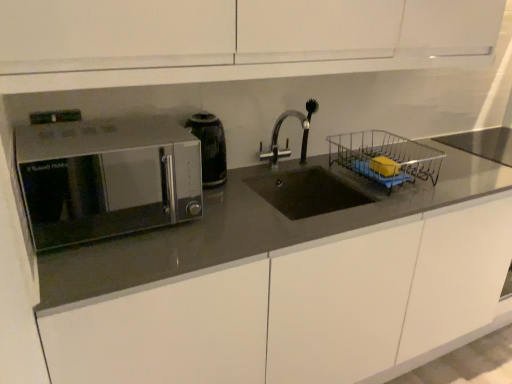
This screenshot has width=512, height=384. I want to click on metallic wire basket at center right, so click(x=385, y=157).

In order to face satin silver microwave at left, should I rotate leftwards or rightwards?

A 18.221 degree turn to the left will do.

Locate an element on the screen. black glossy electric kettle at center-left is located at coordinates (210, 147).

From a real-world perspective, which object stands above the other?

satin silver microwave at left is physically above.

Which of these two, metallic wire basket at center right or satin silver microwave at left, stands taller?

With more height is satin silver microwave at left.

Between metallic wire basket at center right and satin silver microwave at left, which one has larger width?

satin silver microwave at left is wider.

Considering the positions of objects metallic wire basket at center right and satin silver microwave at left in the image provided, who is in front, metallic wire basket at center right or satin silver microwave at left?

satin silver microwave at left is in front.

Is satin metallic microwave at left with silver metallic faucet at center?

No, satin metallic microwave at left is not touching silver metallic faucet at center.

Locate an element on the screen. The width and height of the screenshot is (512, 384). countertop that appears in front of the silver metallic faucet at center is located at coordinates (247, 230).

Considering the points (320, 221) and (264, 154), which point is behind, point (320, 221) or point (264, 154)?

The point (264, 154) is farther.

From a real-world perspective, is satin metallic microwave at left positioned above or below silver metallic faucet at center?

satin metallic microwave at left is below silver metallic faucet at center.

The width and height of the screenshot is (512, 384). What are the coordinates of `appliance behind the satin silver microwave at left` in the screenshot? It's located at (210, 147).

From the image's perspective, between satin silver microwave at left and black glossy electric kettle at center-left, who is located below?

satin silver microwave at left, from the image's perspective.

In the scene shown: Is black glossy electric kettle at center-left a part of satin silver microwave at left?

No, black glossy electric kettle at center-left is located outside of satin silver microwave at left.

Is satin silver microwave at left aimed at black glossy electric kettle at center-left?

No, satin silver microwave at left does not turn towards black glossy electric kettle at center-left.

Which object is positioned more to the left, silver metallic faucet at center or satin silver microwave at left?

satin silver microwave at left is more to the left.

Which is behind, point (305, 137) or point (31, 159)?

Point (305, 137)

You are a GUI agent. You are given a task and a screenshot of the screen. Output one action in this format:
    pyautogui.click(x=<x>, y=<y>)
    Task: Click on the tap beneath the satin silver microwave at left (from a real-world perspective)
    This screenshot has width=512, height=384.
    Given the screenshot: What is the action you would take?
    pyautogui.click(x=287, y=139)

Is silver metallic faucet at center not close to satin silver microwave at left?

That's right, there is a large distance between silver metallic faucet at center and satin silver microwave at left.

Find the location of a particular element. The height and width of the screenshot is (384, 512). tap lying on the right of satin silver microwave at left is located at coordinates (287, 139).

Are satin silver microwave at left and silver metallic faucet at center located far from each other?

Absolutely, satin silver microwave at left is distant from silver metallic faucet at center.

Consider the image. Which object is wider, satin silver microwave at left or silver metallic faucet at center?

With larger width is satin silver microwave at left.

Is satin silver microwave at left not inside silver metallic faucet at center?

satin silver microwave at left lies outside silver metallic faucet at center's area.

Locate an element on the screen. microwave oven that is above the satin metallic microwave at left (from a real-world perspective) is located at coordinates (106, 178).

Is satin metallic microwave at left spatially inside satin silver microwave at left, or outside of it?

satin metallic microwave at left cannot be found inside satin silver microwave at left.

Does satin metallic microwave at left appear on the left side of satin silver microwave at left?

Result: In fact, satin metallic microwave at left is to the right of satin silver microwave at left.

Considering the positions of objects satin metallic microwave at left and satin silver microwave at left in the image provided, who is behind, satin metallic microwave at left or satin silver microwave at left?

satin silver microwave at left.

Find the location of a particular element. Image resolution: width=512 pixels, height=384 pixels. appliance lying below the silver metallic faucet at center (from the image's perspective) is located at coordinates (210, 147).

Which object is positioned more to the left, silver metallic faucet at center or black glossy electric kettle at center-left?

From the viewer's perspective, black glossy electric kettle at center-left appears more on the left side.

From a real-world perspective, is silver metallic faucet at center positioned above or below black glossy electric kettle at center-left?

silver metallic faucet at center is situated lower than black glossy electric kettle at center-left in the real world.

Does silver metallic faucet at center have a greater height compared to black glossy electric kettle at center-left?

Yes, silver metallic faucet at center is taller than black glossy electric kettle at center-left.

This screenshot has height=384, width=512. Identify the location of microwave oven below the metallic wire basket at center right (from the image's perspective). (106, 178).

Where is `countertop beneath the silver metallic faucet at center (from a real-world perspective)`? This screenshot has height=384, width=512. countertop beneath the silver metallic faucet at center (from a real-world perspective) is located at coordinates (247, 230).

When comparing their distances from satin metallic microwave at left, does satin silver microwave at left or silver metallic faucet at center seem closer?

silver metallic faucet at center is positioned closer to the anchor satin metallic microwave at left.

From the picture: Based on their spatial positions, is satin silver microwave at left or black glossy electric kettle at center-left closer to silver metallic faucet at center?

black glossy electric kettle at center-left is closer to silver metallic faucet at center.

When comparing their distances from black glossy electric kettle at center-left, does silver metallic faucet at center or satin silver microwave at left seem closer?

The object closer to black glossy electric kettle at center-left is silver metallic faucet at center.

Based on their spatial positions, is metallic wire basket at center right or silver metallic faucet at center further from satin metallic microwave at left?

silver metallic faucet at center lies further to satin metallic microwave at left than the other object.

When comparing their distances from silver metallic faucet at center, does satin silver microwave at left or satin metallic microwave at left seem further?

Based on the image, satin silver microwave at left appears to be further to silver metallic faucet at center.

Considering their positions, is black glossy electric kettle at center-left positioned closer to satin metallic microwave at left than metallic wire basket at center right?

The object closer to satin metallic microwave at left is metallic wire basket at center right.

Looking at the image, which one is located closer to silver metallic faucet at center, satin metallic microwave at left or metallic wire basket at center right?

metallic wire basket at center right.

Considering their positions, is satin silver microwave at left positioned further to black glossy electric kettle at center-left than metallic wire basket at center right?

satin silver microwave at left is further to black glossy electric kettle at center-left.

What are the coordinates of `tap located between black glossy electric kettle at center-left and metallic wire basket at center right in the left-right direction` in the screenshot? It's located at (287, 139).

Identify the location of tap between black glossy electric kettle at center-left and satin metallic microwave at left from left to right. (287, 139).

The width and height of the screenshot is (512, 384). Identify the location of appliance between satin silver microwave at left and satin metallic microwave at left from left to right. (210, 147).

Identify the location of tap situated between satin silver microwave at left and metallic wire basket at center right from left to right. (287, 139).